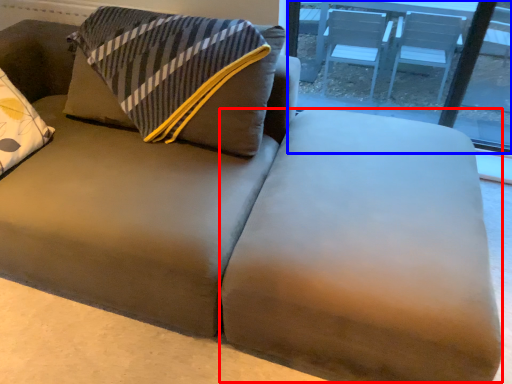
Question: Among these objects, which one is nearest to the camera, flat (highlighted by a red box) or window (highlighted by a blue box)?

Choices:
 (A) flat
 (B) window

Answer: (A)